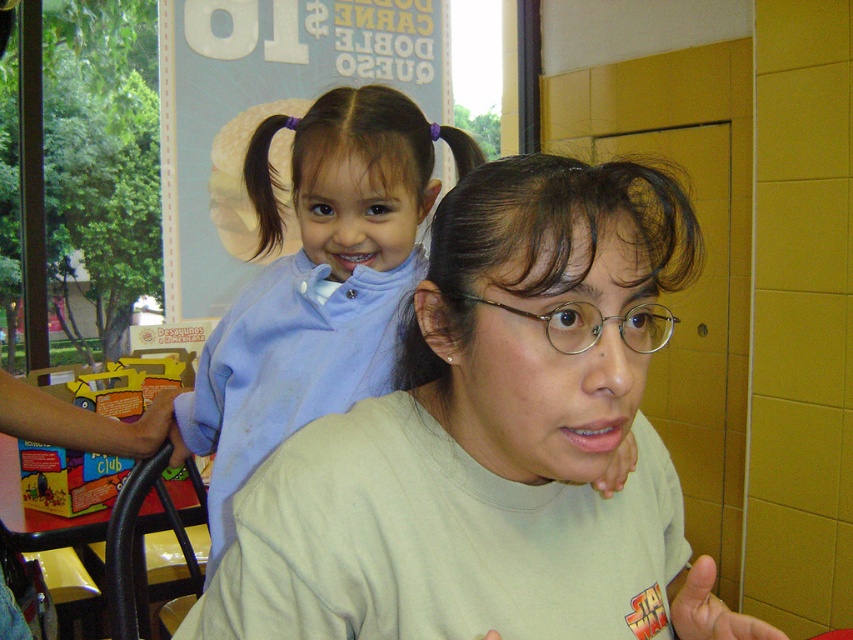
Question: Which of the following is the farthest from the observer?

Choices:
 (A) (264, 129)
 (B) (405, 461)
 (C) (550, 339)
 (D) (144, 380)

Answer: (D)

Question: Which of the following is the closest to the observer?

Choices:
 (A) metallic silver glasses at center
 (B) dark brown silky hair at center

Answer: (B)

Question: Is metallic silver glasses at center further to camera compared to dark brown silky hair at upper left?

Choices:
 (A) no
 (B) yes

Answer: (A)

Question: Based on their relative distances, which object is nearer to the yellow plastic toy car at upper left?

Choices:
 (A) dark brown silky hair at upper left
 (B) metallic silver glasses at center
 (C) light blue fabric at upper left

Answer: (A)

Question: In this image, where is dark brown silky hair at center located relative to dark brown silky hair at upper left?

Choices:
 (A) below
 (B) above

Answer: (A)

Question: Does light green t-shirt at center have a greater width compared to dark brown silky hair at center?

Choices:
 (A) yes
 (B) no

Answer: (A)